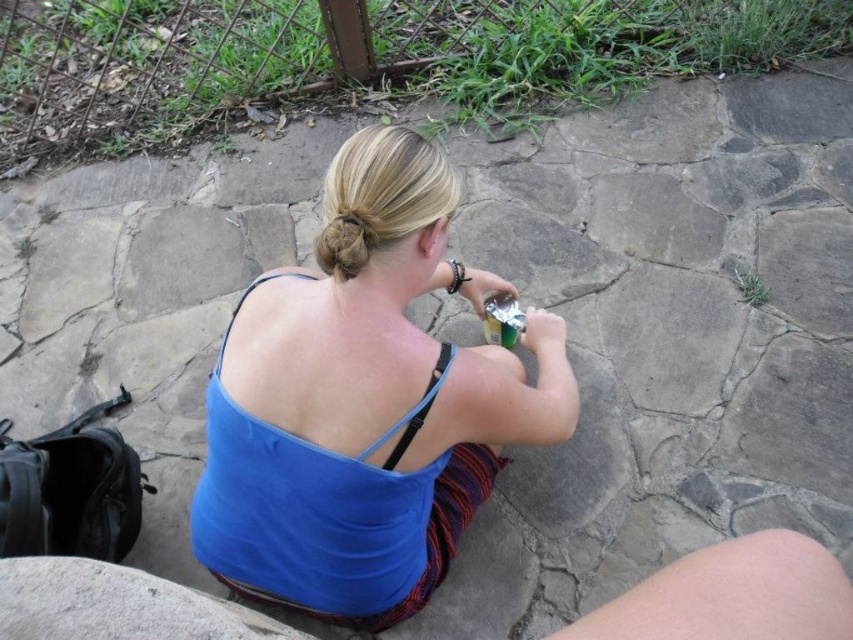
Between skinny white leg at lower right and blonde hair at center, which one appears on the right side from the viewer's perspective?

Positioned to the right is skinny white leg at lower right.

The image size is (853, 640). I want to click on skinny white leg at lower right, so click(732, 595).

Where is `skinny white leg at lower right`? This screenshot has width=853, height=640. skinny white leg at lower right is located at coordinates (732, 595).

This screenshot has width=853, height=640. I want to click on skinny white leg at lower right, so coord(732,595).

How distant is blonde hair at center from metallic green bottle at upper right?

blonde hair at center and metallic green bottle at upper right are 60.00 centimeters apart.

Is the position of blonde hair at center more distant than that of metallic green bottle at upper right?

That is False.

What do you see at coordinates (344, 241) in the screenshot? I see `blonde hair at center` at bounding box center [344, 241].

I want to click on blonde hair at center, so click(x=344, y=241).

Does gray rough stone at lower left have a smaller size compared to metallic green bottle at upper right?

No.

Identify the location of gray rough stone at lower left. This screenshot has width=853, height=640. (115, 604).

Is point (120, 605) closer to viewer compared to point (497, 314)?

Yes, point (120, 605) is in front of point (497, 314).

Locate an element on the screen. This screenshot has width=853, height=640. gray rough stone at lower left is located at coordinates (115, 604).